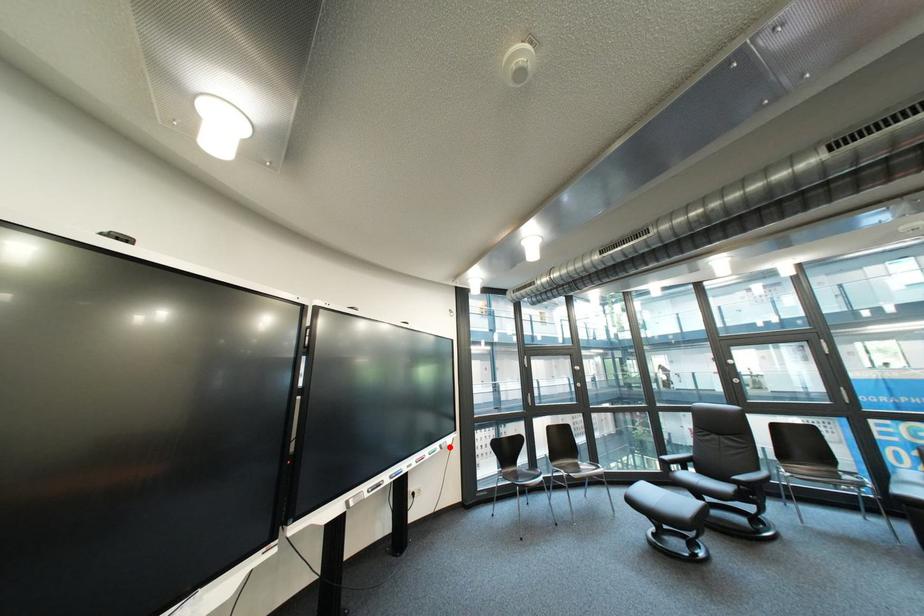
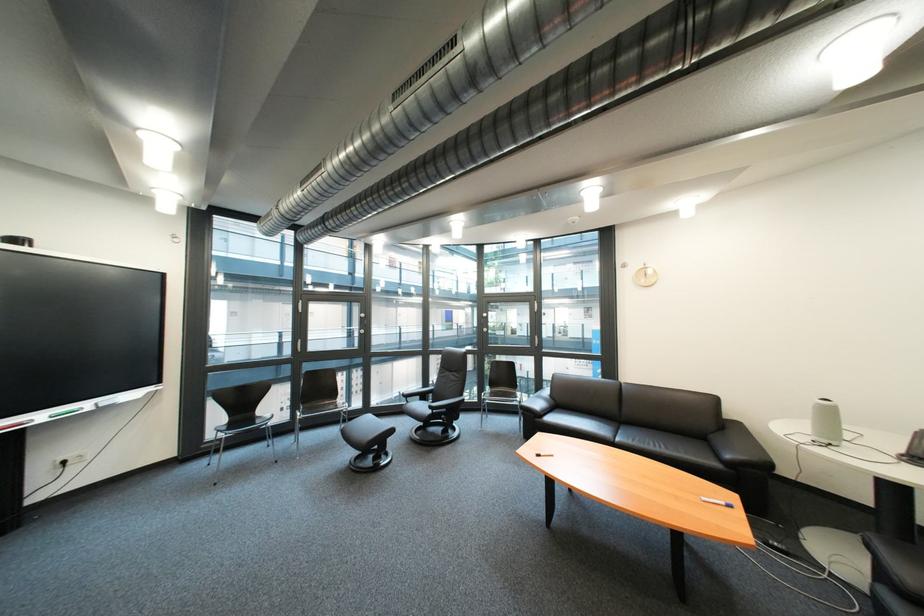
Where in the second image is the point corresponding to the highlighted location from the first image?

(101, 406)